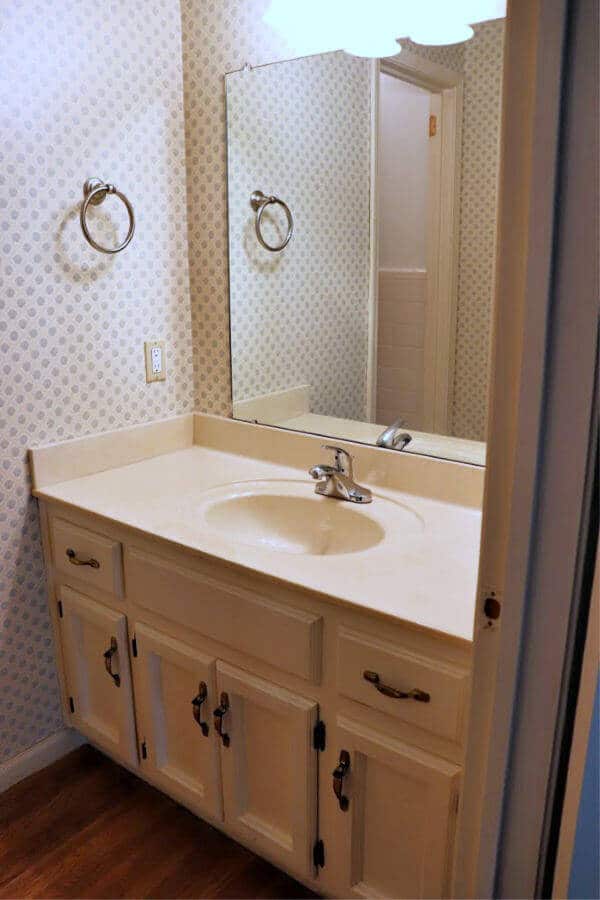
What are the coordinates of `white electric socket` in the screenshot? It's located at (154, 367).